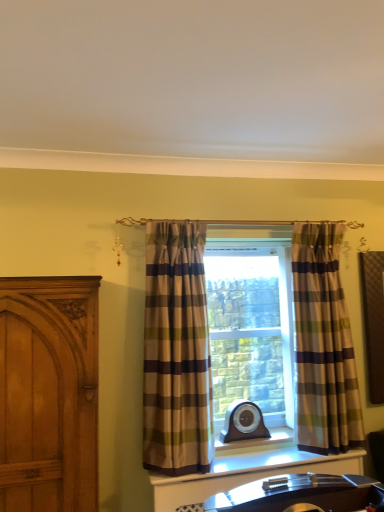
At what (x,y) coordinates should I click in order to perform the action: click on plaid fabric curtain at center, which ranks as the first curtain in right-to-left order. Please return your answer as a coordinate pair (x, y). Image resolution: width=384 pixels, height=512 pixels. Looking at the image, I should click on (323, 344).

At what (x,y) coordinates should I click in order to perform the action: click on wooden carved door at left. Please return your answer as a coordinate pair (x, y). Image resolution: width=384 pixels, height=512 pixels. Looking at the image, I should click on (49, 393).

Find the location of a particular element. The image size is (384, 512). plaid fabric curtain at center, which ranks as the first curtain in right-to-left order is located at coordinates (323, 344).

Are plaid fabric curtain at center, the first curtain positioned from the left, and plaid fabric curtain at center, placed as the 2th curtain when sorted from left to right, far apart?

plaid fabric curtain at center, the first curtain positioned from the left, is near plaid fabric curtain at center, placed as the 2th curtain when sorted from left to right, not far away.

From a real-world perspective, is plaid fabric curtain at center, the second curtain from the right, positioned under plaid fabric curtain at center, which ranks as the first curtain in right-to-left order, based on gravity?

Incorrect, from a real-world perspective, plaid fabric curtain at center, the second curtain from the right, is higher than plaid fabric curtain at center, which ranks as the first curtain in right-to-left order.

From the picture: Which of these two, plaid fabric curtain at center, the second curtain from the right, or plaid fabric curtain at center, placed as the 2th curtain when sorted from left to right, is thinner?

plaid fabric curtain at center, placed as the 2th curtain when sorted from left to right, is thinner.

Is point (201, 443) closer to camera compared to point (340, 433)?

That is True.

From the image's perspective, is plaid fabric curtain at center, the second curtain from the right, beneath wooden carved door at left?

Actually, plaid fabric curtain at center, the second curtain from the right, appears above wooden carved door at left in the image.

In the scene shown: Who is bigger, plaid fabric curtain at center, the first curtain positioned from the left, or wooden carved door at left?

wooden carved door at left.

Which object is wider, plaid fabric curtain at center, the first curtain positioned from the left, or wooden carved door at left?

wooden carved door at left is wider.

Locate an element on the screen. This screenshot has width=384, height=512. cabinetry in front of the plaid fabric curtain at center, the first curtain positioned from the left is located at coordinates (49, 393).

Is plaid fabric curtain at center, which ranks as the first curtain in right-to-left order, far away from wooden carved door at left?

Indeed, plaid fabric curtain at center, which ranks as the first curtain in right-to-left order, is not near wooden carved door at left.

Is wooden carved door at left surrounded by plaid fabric curtain at center, which ranks as the first curtain in right-to-left order?

No, plaid fabric curtain at center, which ranks as the first curtain in right-to-left order, does not contain wooden carved door at left.

Based on the photo, is plaid fabric curtain at center, placed as the 2th curtain when sorted from left to right, looking in the opposite direction of wooden carved door at left?

plaid fabric curtain at center, placed as the 2th curtain when sorted from left to right, does not have its back to wooden carved door at left.

From the image's perspective, between plaid fabric curtain at center, which ranks as the first curtain in right-to-left order, and wooden carved door at left, who is located below?

wooden carved door at left is shown below in the image.

Does point (28, 392) appear closer or farther from the camera than point (295, 313)?

Point (28, 392) is positioned closer to the camera compared to point (295, 313).

Looking at this image, would you say wooden carved door at left is a long distance from plaid fabric curtain at center, placed as the 2th curtain when sorted from left to right?

Yes, wooden carved door at left and plaid fabric curtain at center, placed as the 2th curtain when sorted from left to right, are quite far apart.

Considering the sizes of objects wooden carved door at left and plaid fabric curtain at center, which ranks as the first curtain in right-to-left order, in the image provided, who is shorter, wooden carved door at left or plaid fabric curtain at center, which ranks as the first curtain in right-to-left order,?

Standing shorter between the two is wooden carved door at left.

Is wooden carved door at left oriented away from plaid fabric curtain at center, placed as the 2th curtain when sorted from left to right?

No, wooden carved door at left is not facing away from plaid fabric curtain at center, placed as the 2th curtain when sorted from left to right.

Is plaid fabric curtain at center, which ranks as the first curtain in right-to-left order, placed right next to plaid fabric curtain at center, the first curtain positioned from the left?

plaid fabric curtain at center, which ranks as the first curtain in right-to-left order, and plaid fabric curtain at center, the first curtain positioned from the left, are not in contact.

From the picture: Is plaid fabric curtain at center, placed as the 2th curtain when sorted from left to right, completely or partially outside of plaid fabric curtain at center, the first curtain positioned from the left?

Yes, plaid fabric curtain at center, placed as the 2th curtain when sorted from left to right, is not within plaid fabric curtain at center, the first curtain positioned from the left.

Which of these two, plaid fabric curtain at center, placed as the 2th curtain when sorted from left to right, or plaid fabric curtain at center, the second curtain from the right, is wider?

plaid fabric curtain at center, the second curtain from the right, is wider.

Which is closer to the camera, (340, 357) or (151, 446)?

Point (340, 357) is positioned farther from the camera compared to point (151, 446).

Is wooden carved door at left aimed at plaid fabric curtain at center, the second curtain from the right?

No, wooden carved door at left is not facing towards plaid fabric curtain at center, the second curtain from the right.

Is wooden carved door at left surrounding plaid fabric curtain at center, the first curtain positioned from the left?

That's incorrect, plaid fabric curtain at center, the first curtain positioned from the left, is not inside wooden carved door at left.

Considering the sizes of objects wooden carved door at left and plaid fabric curtain at center, the second curtain from the right, in the image provided, who is wider, wooden carved door at left or plaid fabric curtain at center, the second curtain from the right,?

Wider between the two is wooden carved door at left.

Based on the photo, from the image's perspective, who appears lower, wooden carved door at left or plaid fabric curtain at center, the second curtain from the right?

From the image's view, wooden carved door at left is below.

Locate an element on the screen. The image size is (384, 512). curtain below the plaid fabric curtain at center, the second curtain from the right (from the image's perspective) is located at coordinates (323, 344).

Where is `cabinetry in front of the plaid fabric curtain at center, the first curtain positioned from the left`? This screenshot has height=512, width=384. cabinetry in front of the plaid fabric curtain at center, the first curtain positioned from the left is located at coordinates (49, 393).

From the image, which object appears to be farther from plaid fabric curtain at center, the second curtain from the right, wooden carved door at left or plaid fabric curtain at center, placed as the 2th curtain when sorted from left to right?

Based on the image, plaid fabric curtain at center, placed as the 2th curtain when sorted from left to right, appears to be further to plaid fabric curtain at center, the second curtain from the right.

Based on their spatial positions, is wooden carved door at left or plaid fabric curtain at center, the second curtain from the right, closer to plaid fabric curtain at center, placed as the 2th curtain when sorted from left to right?

The object closer to plaid fabric curtain at center, placed as the 2th curtain when sorted from left to right, is plaid fabric curtain at center, the second curtain from the right.

In the scene shown: Looking at the image, which one is located further to plaid fabric curtain at center, the second curtain from the right, plaid fabric curtain at center, placed as the 2th curtain when sorted from left to right, or wooden carved door at left?

plaid fabric curtain at center, placed as the 2th curtain when sorted from left to right, is positioned further to the anchor plaid fabric curtain at center, the second curtain from the right.

Which object lies further to the anchor point wooden carved door at left, plaid fabric curtain at center, the first curtain positioned from the left, or plaid fabric curtain at center, placed as the 2th curtain when sorted from left to right?

plaid fabric curtain at center, placed as the 2th curtain when sorted from left to right, lies further to wooden carved door at left than the other object.

Looking at the image, which one is located closer to wooden carved door at left, plaid fabric curtain at center, which ranks as the first curtain in right-to-left order, or plaid fabric curtain at center, the first curtain positioned from the left?

plaid fabric curtain at center, the first curtain positioned from the left, is positioned closer to the anchor wooden carved door at left.

From the image, which object appears to be farther from plaid fabric curtain at center, placed as the 2th curtain when sorted from left to right, plaid fabric curtain at center, the second curtain from the right, or wooden carved door at left?

Among the two, wooden carved door at left is located further to plaid fabric curtain at center, placed as the 2th curtain when sorted from left to right.

The width and height of the screenshot is (384, 512). I want to click on curtain located between wooden carved door at left and plaid fabric curtain at center, which ranks as the first curtain in right-to-left order, in the left-right direction, so click(x=176, y=352).